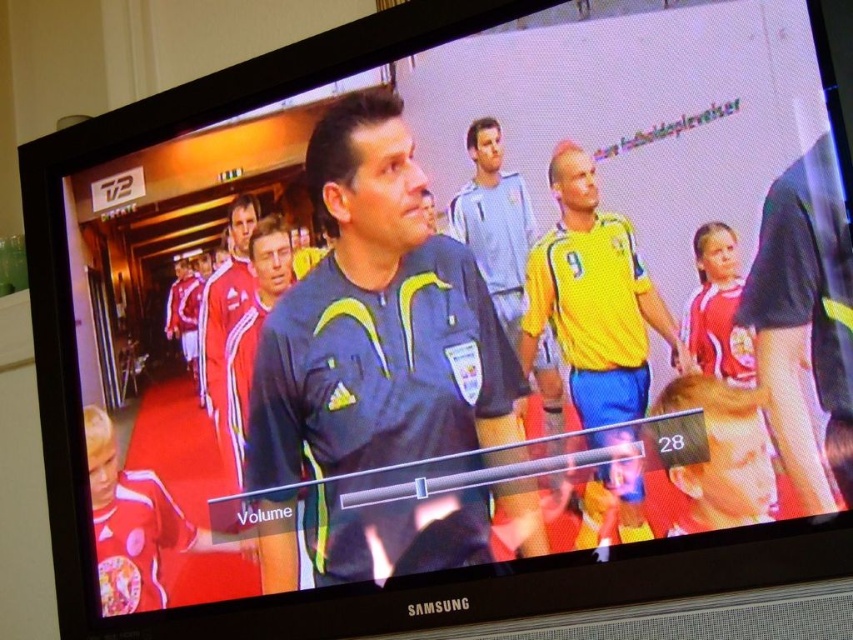
You are standing in front of the Samsung TV and want to touch the two points on the screen. Which point, point (x=258, y=397) or point (x=675, y=355), is closer to your hand when you reach out to the screen?

Point (x=258, y=397) is closer to your hand because it is further to the camera than point (x=675, y=355), meaning it appears nearer on the screen.